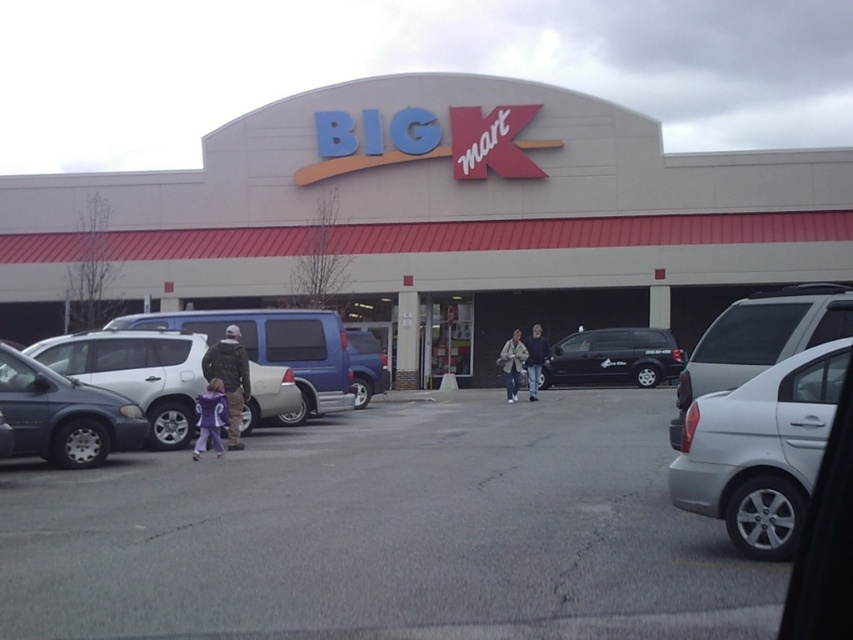
Question: Can you confirm if matte gray building at center is positioned below silver metallic sedan at right?

Choices:
 (A) no
 (B) yes

Answer: (A)

Question: Which is farther from the matte gray building at center?

Choices:
 (A) black matte minivan at center
 (B) blue matte suv at center
 (C) silver metallic sedan at right

Answer: (C)

Question: Can you confirm if matte white suv at left is wider than blue matte suv at center?

Choices:
 (A) yes
 (B) no

Answer: (B)

Question: Which point appears closest to the camera in this image?

Choices:
 (A) (782, 412)
 (B) (503, 353)

Answer: (A)

Question: Which object appears closest to the camera in this image?

Choices:
 (A) light beige jacket at center
 (B) matte gray building at center
 (C) matte white suv at center-left
 (D) gray asphalt parking lot at center

Answer: (D)

Question: Does camouflage jacket at left appear on the right side of dark blue jeans at center?

Choices:
 (A) no
 (B) yes

Answer: (A)